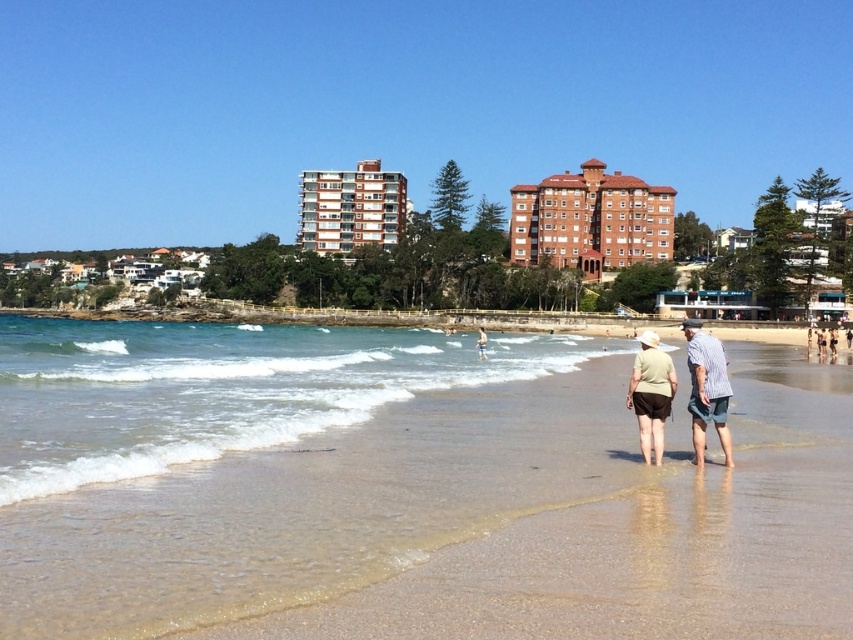
You are planning to build a new small cabin that is 2 meters tall. You want to place it between the brown brick building at upper center and the red brick building at center. Which building should you place it next to so that the cabin doesn

The brown brick building at upper center is shorter than the red brick building at center. Therefore, placing the cabin next to the brown brick building at upper center would ensure it is not overshadowed by taller structures.

You are a photographer standing on the beach and want to capture a photo where the clear water at lower center and the khaki cotton shirt at center are both visible. Based on their positions, which object will appear larger in the photo?

The clear water at lower center appears larger in the photo because it is taller than the khaki cotton shirt at center.

You are standing on the beach and want to take a photo of both the brown brick building at upper center and the red brick building at center. Which building should you focus on first to ensure both are in the frame?

You should focus on the brown brick building at upper center first because it is closer to you than the red brick building at center, so adjusting the camera to include it will naturally include the farther one as well.